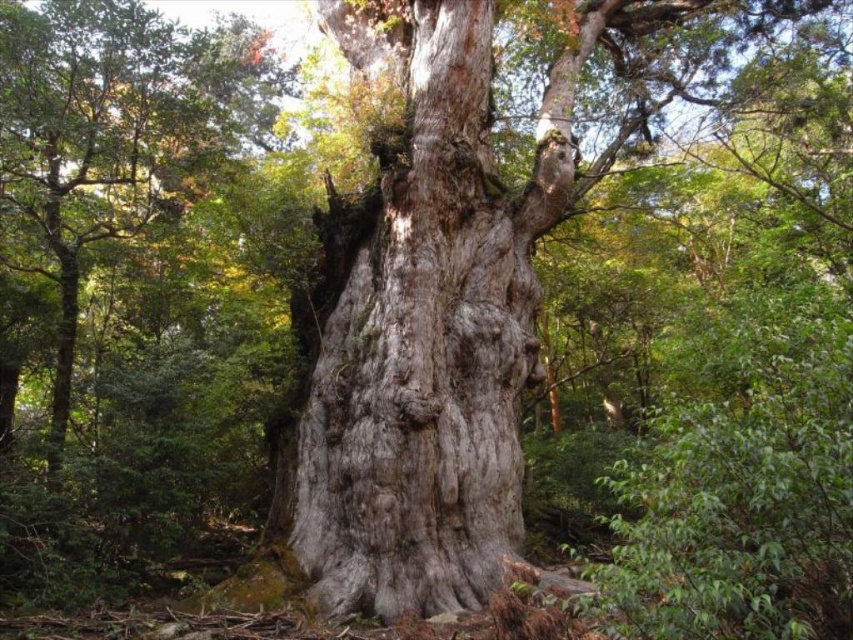
From the picture: You are standing in the dense forest and see the gray rough bark tree trunk at center and the gray rough bark tree at center. Which one is located to the right side of the other?

The gray rough bark tree trunk at center is positioned on the right side of the gray rough bark tree at center.

You are standing in a dense forest and see a point marked at coordinates (426, 330). What does this point represent in the scene?

The point at coordinates (426, 330) represents the gray rough bark tree trunk at center.